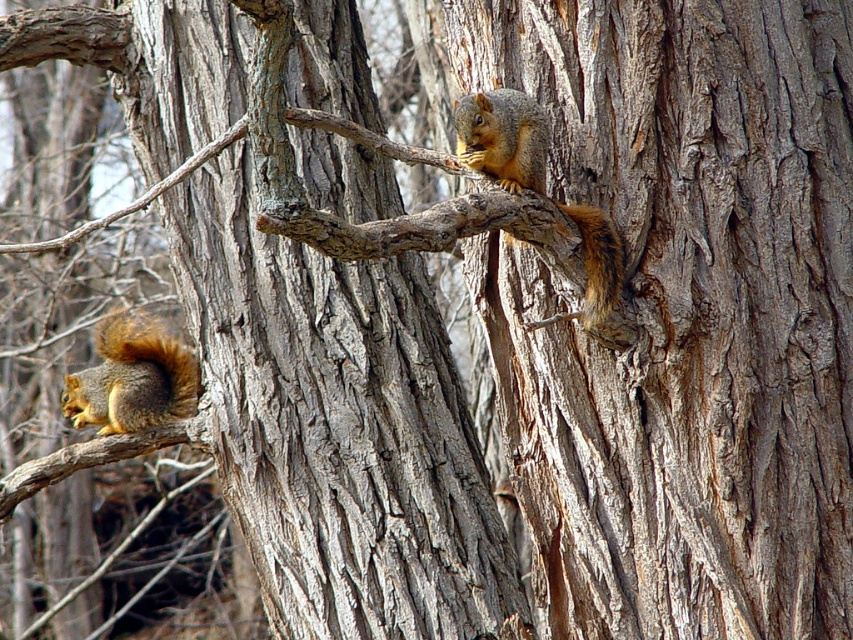
Which of these two, grayish-brown bark tree trunk at center or brown fuzzy tail at upper right, stands shorter?

brown fuzzy tail at upper right is shorter.

Which is more to the left, grayish-brown bark tree trunk at center or brown fuzzy tail at upper right?

brown fuzzy tail at upper right

Is point (717, 632) less distant than point (592, 282)?

No, (717, 632) is behind (592, 282).

I want to click on grayish-brown bark tree trunk at center, so click(x=682, y=314).

Between point (432, 520) and point (30, 461), which one is positioned behind?

The point (30, 461) is behind.

Measure the distance from gray rough bark tree trunk at center to brown rough tree branch at lower left.

The distance of gray rough bark tree trunk at center from brown rough tree branch at lower left is 3.29 feet.

Between point (219, 362) and point (86, 456), which one is positioned in front?

Point (219, 362) is more forward.

What are the coordinates of `gray rough bark tree trunk at center` in the screenshot? It's located at (337, 428).

Can you confirm if gray rough bark tree trunk at center is bigger than brown fuzzy tail at upper right?

Yes.

Who is positioned more to the left, gray rough bark tree trunk at center or brown fuzzy tail at upper right?

gray rough bark tree trunk at center

This screenshot has width=853, height=640. What are the coordinates of `gray rough bark tree trunk at center` in the screenshot? It's located at (x=337, y=428).

You are a GUI agent. You are given a task and a screenshot of the screen. Output one action in this format:
    pyautogui.click(x=<x>, y=<y>)
    Task: Click on the gray rough bark tree trunk at center
    Image resolution: width=853 pixels, height=640 pixels.
    Given the screenshot: What is the action you would take?
    pyautogui.click(x=337, y=428)